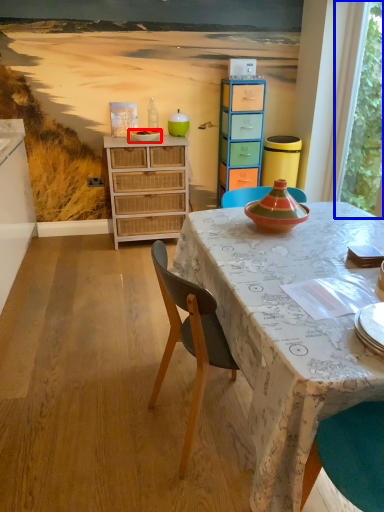
Question: Which of the following is the closest to the observer, bowl (highlighted by a red box) or window screen (highlighted by a blue box)?

Choices:
 (A) bowl
 (B) window screen

Answer: (B)